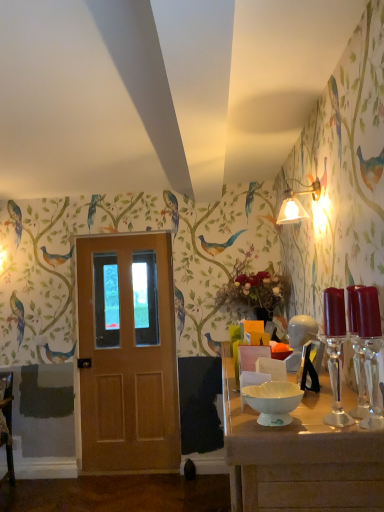
Question: Does matte white lampshade at upper right turn towards white glossy table at lower right?

Choices:
 (A) no
 (B) yes

Answer: (A)

Question: Is matte white lampshade at upper right thinner than white glossy table at lower right?

Choices:
 (A) no
 (B) yes

Answer: (B)

Question: From the image's perspective, is matte white lampshade at upper right located beneath white glossy table at lower right?

Choices:
 (A) yes
 (B) no

Answer: (B)

Question: Is matte white lampshade at upper right not close to white glossy table at lower right?

Choices:
 (A) yes
 (B) no

Answer: (A)

Question: Is matte white lampshade at upper right turned away from white glossy table at lower right?

Choices:
 (A) yes
 (B) no

Answer: (B)

Question: In terms of size, does matte white lampshade at upper right appear bigger or smaller than white glossy table at lower right?

Choices:
 (A) big
 (B) small

Answer: (B)

Question: In the image, is matte white lampshade at upper right on the left side or the right side of white glossy table at lower right?

Choices:
 (A) right
 (B) left

Answer: (A)

Question: Is matte white lampshade at upper right wider or thinner than white glossy table at lower right?

Choices:
 (A) thin
 (B) wide

Answer: (A)

Question: Does point (306, 189) appear closer or farther from the camera than point (235, 416)?

Choices:
 (A) closer
 (B) farther

Answer: (B)

Question: Is white glossy table at lower right to the left or to the right of white glossy bowl at center in the image?

Choices:
 (A) left
 (B) right

Answer: (B)

Question: Based on their sizes in the image, would you say white glossy table at lower right is bigger or smaller than white glossy bowl at center?

Choices:
 (A) small
 (B) big

Answer: (B)

Question: In terms of width, does white glossy table at lower right look wider or thinner when compared to white glossy bowl at center?

Choices:
 (A) wide
 (B) thin

Answer: (A)

Question: Is white glossy table at lower right taller or shorter than white glossy bowl at center?

Choices:
 (A) short
 (B) tall

Answer: (B)

Question: From the image's perspective, is white glossy table at lower right located above or below wooden door at center?

Choices:
 (A) above
 (B) below

Answer: (B)

Question: Considering the positions of white glossy table at lower right and wooden door at center in the image, is white glossy table at lower right bigger or smaller than wooden door at center?

Choices:
 (A) big
 (B) small

Answer: (A)